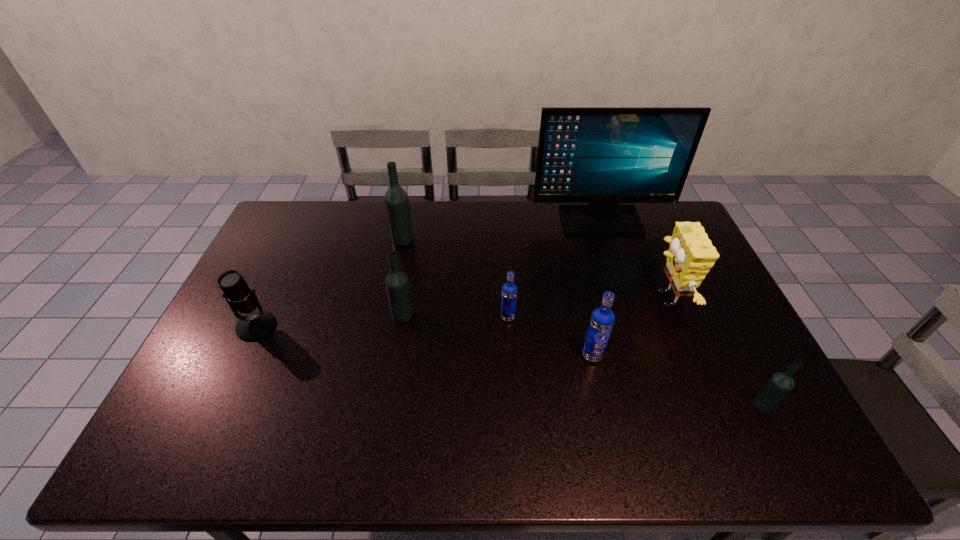
Identify the location of vacant space that is in between the left blue vodka and the second farthest black vodka. This screenshot has height=540, width=960. (455, 316).

I want to click on free space that is in between the third vodka from right to left and the sponge, so click(587, 308).

Find the location of a particular element. This screenshot has height=540, width=960. free space between the leftmost object and the black monitor is located at coordinates (428, 273).

Find the location of `free space between the yellow sponge and the fourth object from left to right`. free space between the yellow sponge and the fourth object from left to right is located at coordinates (587, 308).

At what (x,y) coordinates should I click in order to perform the action: click on vacant region between the monitor and the sponge. Please return your answer as a coordinate pair (x, y). This screenshot has width=960, height=540. Looking at the image, I should click on (633, 260).

Identify the location of vacant space that's between the nearest black vodka and the nearer blue vodka. (678, 381).

You are a GUI agent. You are given a task and a screenshot of the screen. Output one action in this format:
    pyautogui.click(x=<x>, y=<y>)
    Task: Click on the third closest object to the rightmost vodka
    The image size is (960, 540).
    Given the screenshot: What is the action you would take?
    pyautogui.click(x=509, y=290)

Locate which object ranks fourth in proximity to the nearest black vodka. Please provide its 2D coordinates. Your answer should be formatted as a tuple, i.e. [(x, y)], where the tuple contains the x and y coordinates of a point satisfying the conditions above.

[(602, 156)]

Locate an element on the screen. The height and width of the screenshot is (540, 960). the closest vodka relative to the seventh shortest object is located at coordinates (397, 285).

Where is `the closest vodka to the yellow sponge`? Image resolution: width=960 pixels, height=540 pixels. the closest vodka to the yellow sponge is located at coordinates (602, 319).